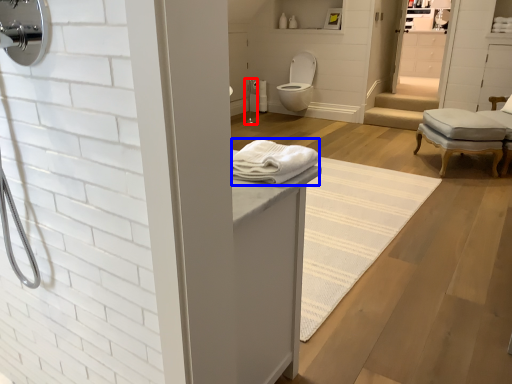
Question: Which point is closer to the camera, shower (highlighted by a red box) or bath towel (highlighted by a blue box)?

Choices:
 (A) shower
 (B) bath towel

Answer: (B)